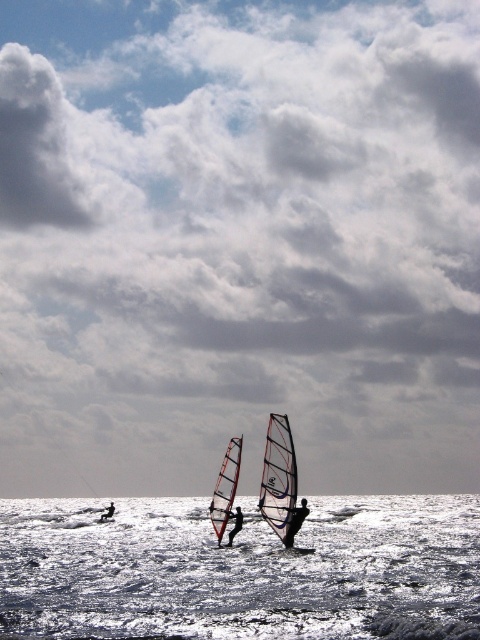
Based on the photo, you are a photographer standing on the shore observing the seascape. You notice the dark blue fabric sail at center and the dark blue wetsuit at lower left. Which object appears taller in the image?

The dark blue wetsuit at lower left appears taller because the dark blue fabric sail at center is shorter than it.

You are a photographer trying to capture the white frothy water at center and the transparent white sail at center in a single shot. Based on their heights, which one will appear taller in the photo?

The white frothy water at center will appear taller in the photo because it has a greater height compared to the transparent white sail at center.

You are a photographer trying to capture the windsurfers in the scene. You notice the white frothy water at center and the dark blue wetsuit at lower left. Which object appears closer to the camera based on their sizes?

The white frothy water at center appears closer to the camera because it is taller than the dark blue wetsuit at lower left, indicating it is nearer in perspective.